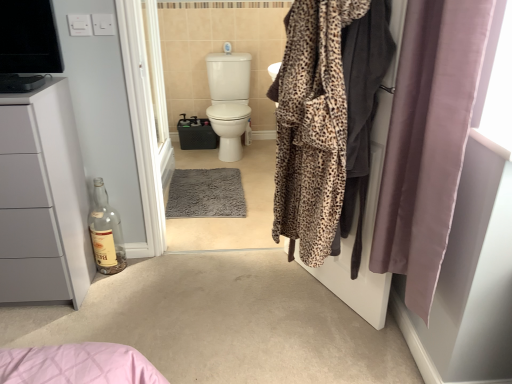
Identify the location of vacant space that is to the left of white glossy toilet at center. The width and height of the screenshot is (512, 384). (190, 158).